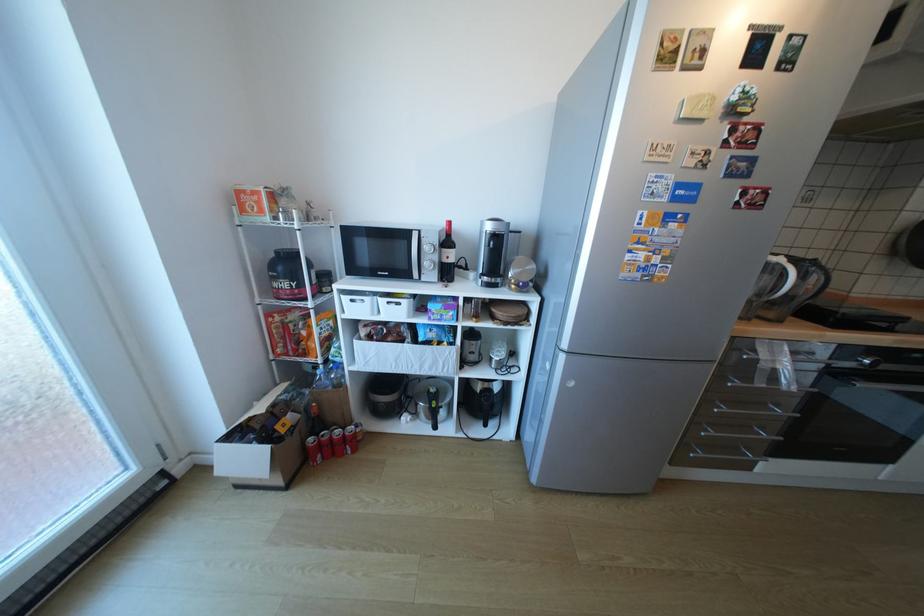
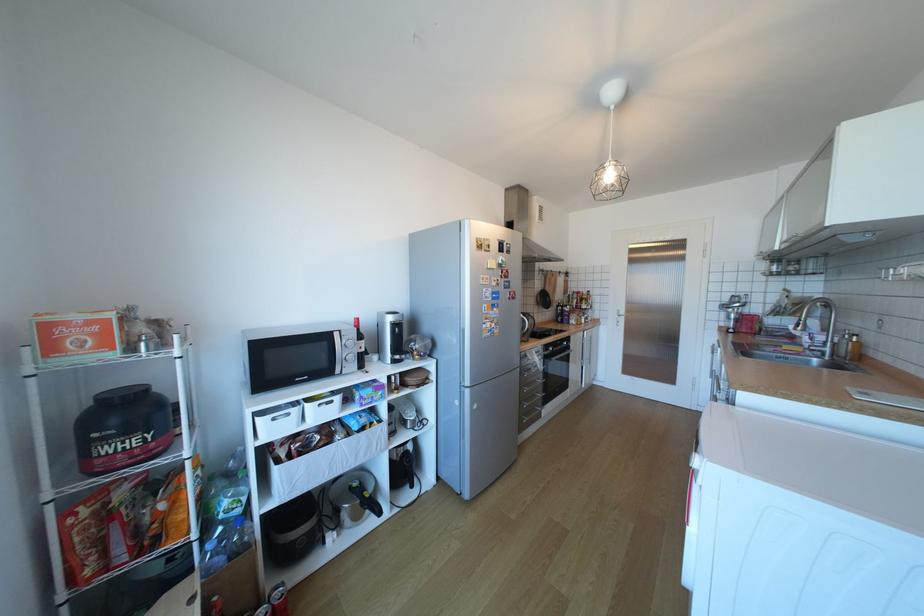
Find the pixel in the second image that matches (x=353, y=435) in the first image.

(283, 607)